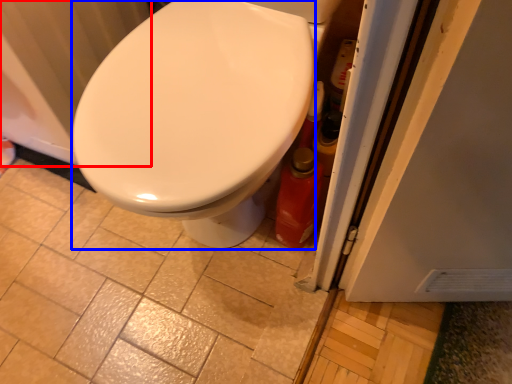
Question: Which object appears farthest to the camera in this image, radiator (highlighted by a red box) or bidet (highlighted by a blue box)?

Choices:
 (A) radiator
 (B) bidet

Answer: (A)